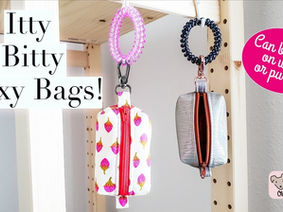
Find the location of `white wall`. white wall is located at coordinates (11, 135).